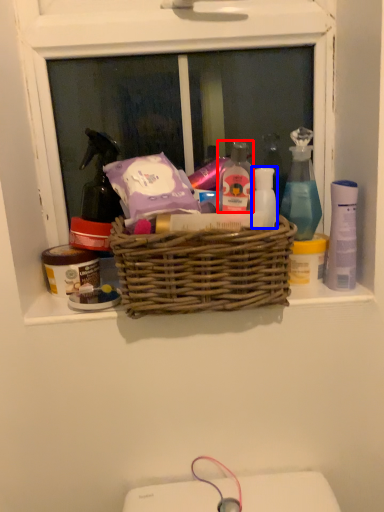
Question: Which object is closer to the camera taking this photo, toiletry (highlighted by a red box) or toiletry (highlighted by a blue box)?

Choices:
 (A) toiletry
 (B) toiletry

Answer: (A)